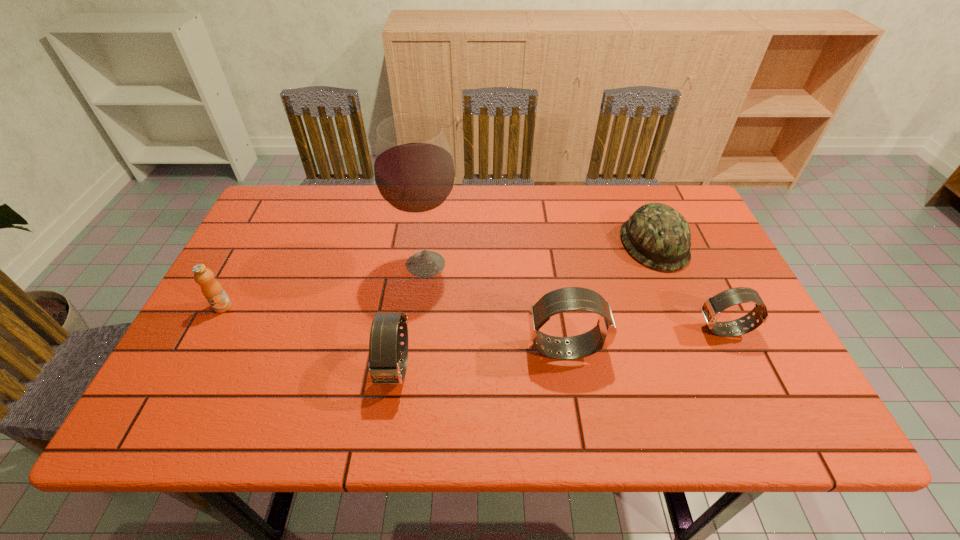
This screenshot has height=540, width=960. What are the coordinates of `free space between the headwear and the leftmost object` in the screenshot? It's located at (439, 275).

In order to click on free point between the headwear and the leftmost watch in this screenshot , I will do `click(525, 306)`.

Find the location of `empty space that is in between the second shortest watch and the second watch from left to right`. empty space that is in between the second shortest watch and the second watch from left to right is located at coordinates (481, 358).

Locate an element on the screen. This screenshot has width=960, height=540. free spot between the headwear and the orange juice is located at coordinates pyautogui.click(x=439, y=275).

Find the location of a particular element. This screenshot has height=540, width=960. object that is the fifth closest to the headwear is located at coordinates (212, 290).

Identify which object is the third closest to the headwear. Please provide its 2D coordinates. Your answer should be formatted as a tuple, i.e. [(x, y)], where the tuple contains the x and y coordinates of a point satisfying the conditions above.

[(414, 172)]

What are the coordinates of `watch that stands as the second closest to the shortest watch` in the screenshot? It's located at tap(385, 347).

Image resolution: width=960 pixels, height=540 pixels. What are the coordinates of `watch that is the second closest to the leftmost watch` in the screenshot? It's located at (712, 307).